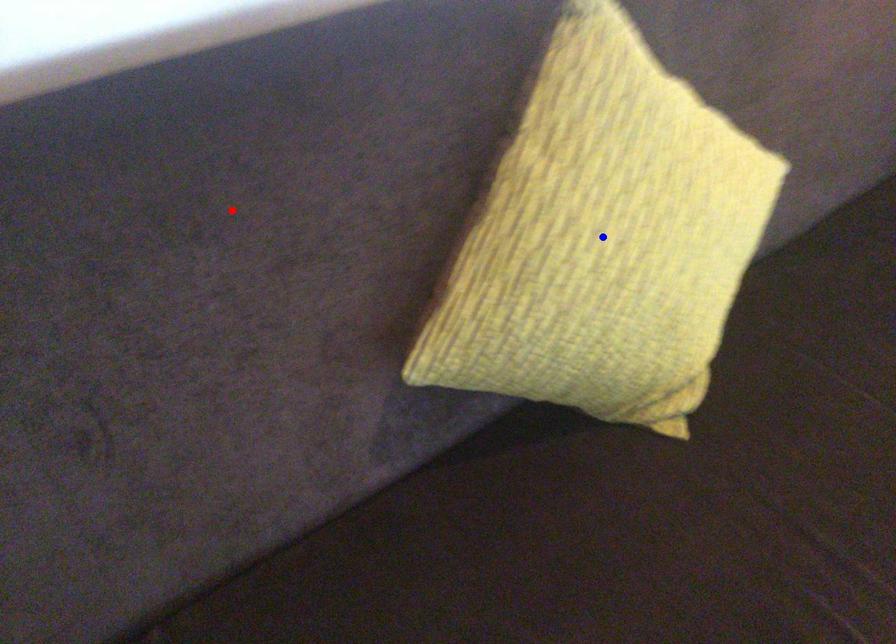
Question: Which of the two points in the image is closer to the camera?

Choices:
 (A) Blue point is closer.
 (B) Red point is closer.

Answer: (B)